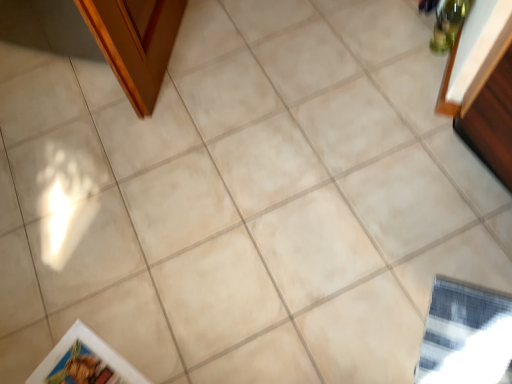
Locate an element on the screen. Image resolution: width=512 pixels, height=384 pixels. free space to the left of green glass bottle at upper right is located at coordinates (393, 50).